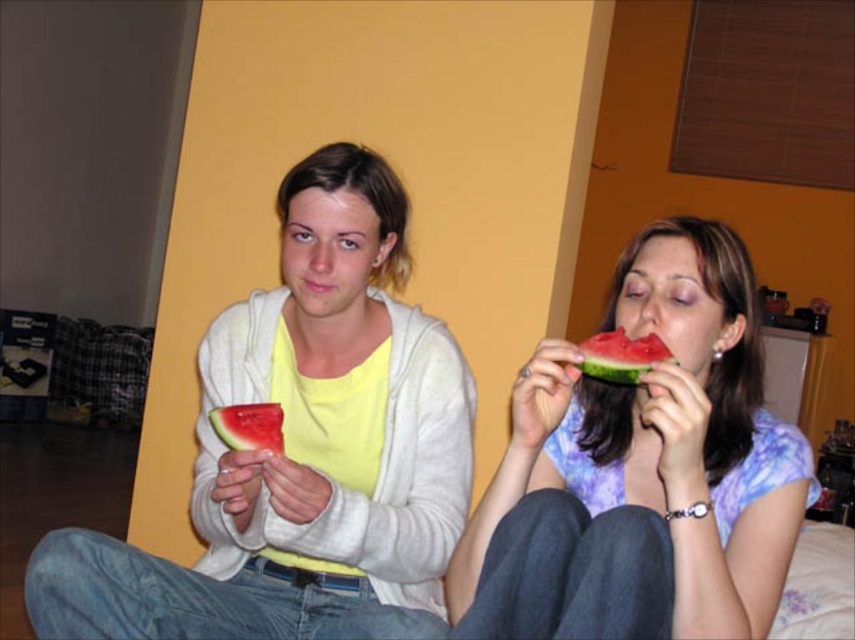
You are a photographer setting up a shoot in this room. You want to place a small prop between the matte purple shirt at right and the watermelon at center. Based on their positions, where should you place the prop to ensure it is centered between them?

The prop should be placed to the left of the watermelon at center since the matte purple shirt at right is on its right side, so centering between them would require positioning it closer to the watermelon.

You are a photographer setting up a shoot in this room. You want to place a small prop between the matte purple shirt at right and the watermelon at center. Based on their positions, where should you place the prop?

The matte purple shirt at right is located below the watermelon at center, so you should place the prop between them either above the matte purple shirt at right and below the watermelon at center or below the watermelon at center and above the matte purple shirt at right depending on the desired arrangement.

Based on the scene description, can you determine the spatial relationship between the matte yellow shirt at center and the watermelon at center?

The matte yellow shirt at center is below the watermelon at center according to the description.